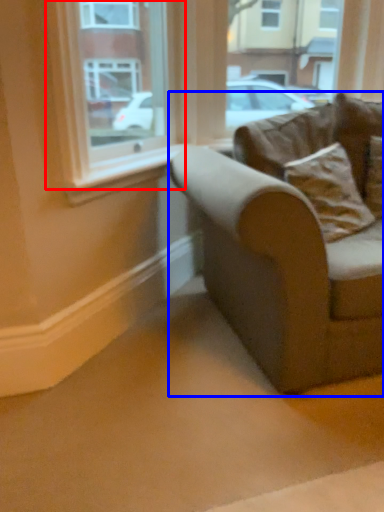
Question: Which object appears farthest to the camera in this image, window (highlighted by a red box) or studio couch (highlighted by a blue box)?

Choices:
 (A) window
 (B) studio couch

Answer: (A)